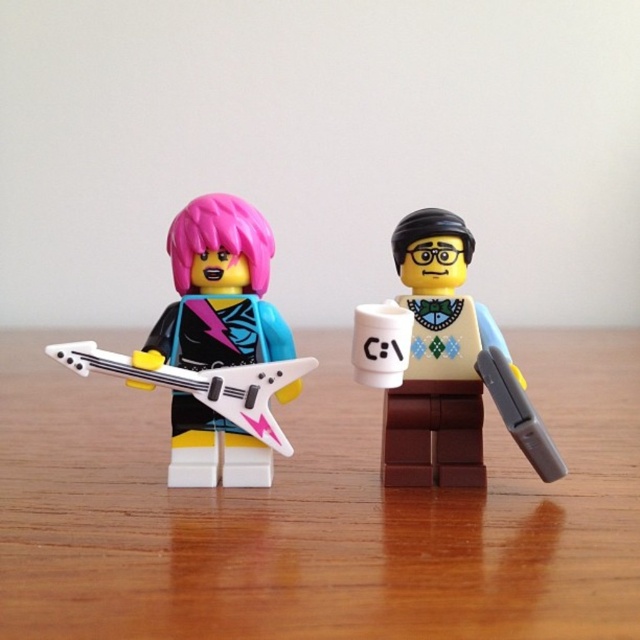
Is matte black guitar at left positioned in front of white plastic guitar at left?

That is False.

Does point (216, 330) lie in front of point (250, 390)?

No, (216, 330) is further to viewer.

Where is `matte black guitar at left`? The image size is (640, 640). matte black guitar at left is located at coordinates (218, 291).

Between matte brown briefcase at right and matte black guitar at left, which one is positioned lower?

matte brown briefcase at right is below.

Who is positioned more to the left, matte brown briefcase at right or matte black guitar at left?

From the viewer's perspective, matte black guitar at left appears more on the left side.

Which is behind, point (442, 298) or point (260, 444)?

The point (442, 298) is more distant.

This screenshot has width=640, height=640. I want to click on matte brown briefcase at right, so (x=451, y=368).

Between point (428, 483) and point (116, 353), which one is positioned behind?

Positioned behind is point (116, 353).

Who is higher up, matte brown briefcase at right or white plastic guitar at left?

matte brown briefcase at right

What do you see at coordinates (451, 368) in the screenshot? The height and width of the screenshot is (640, 640). I see `matte brown briefcase at right` at bounding box center [451, 368].

Find the location of `matte brown briefcase at right`. matte brown briefcase at right is located at coordinates (451, 368).